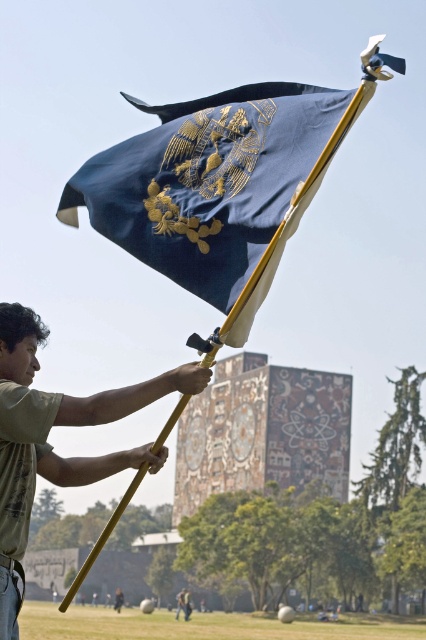
Is point (244, 154) farther from viewer compared to point (9, 410)?

That is False.

Is point (204, 189) closer to viewer compared to point (123, 403)?

Yes, point (204, 189) is closer to viewer.

Where is `blue silk flag at center`? This screenshot has height=640, width=426. blue silk flag at center is located at coordinates (216, 186).

I want to click on blue silk flag at center, so click(216, 186).